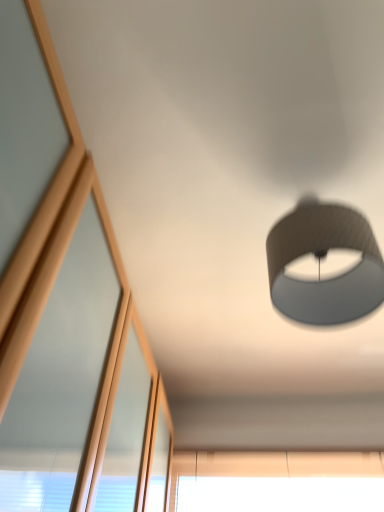
Question: From a real-world perspective, is beige fabric window at lower center positioned above or below matte gray lampshade at upper right?

Choices:
 (A) above
 (B) below

Answer: (B)

Question: Choose the correct answer: Is beige fabric window at lower center inside matte gray lampshade at upper right or outside it?

Choices:
 (A) outside
 (B) inside

Answer: (A)

Question: Based on their sizes in the image, would you say beige fabric window at lower center is bigger or smaller than matte gray lampshade at upper right?

Choices:
 (A) small
 (B) big

Answer: (A)

Question: Relative to beige fabric window at lower center, is matte gray lampshade at upper right in front or behind?

Choices:
 (A) behind
 (B) front

Answer: (B)

Question: Is matte gray lampshade at upper right to the left or to the right of beige fabric window at lower center in the image?

Choices:
 (A) left
 (B) right

Answer: (A)

Question: From the image's perspective, relative to beige fabric window at lower center, is matte gray lampshade at upper right above or below?

Choices:
 (A) above
 (B) below

Answer: (A)

Question: From a real-world perspective, is matte gray lampshade at upper right physically located above or below beige fabric window at lower center?

Choices:
 (A) above
 (B) below

Answer: (A)